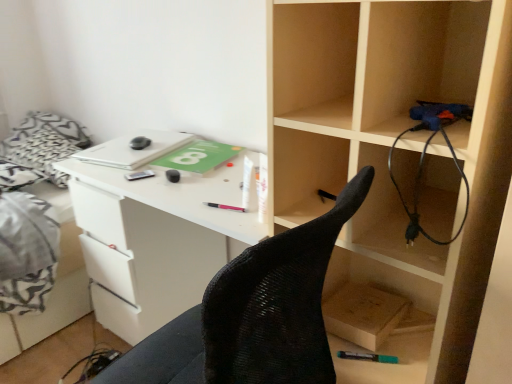
Find the location of a particular element. The width and height of the screenshot is (512, 384). free space that is in between metallic silver pen at center, the 3th stationery from the bottom, and pink plastic pen at center, acting as the 2th stationery starting from the right is located at coordinates (175, 190).